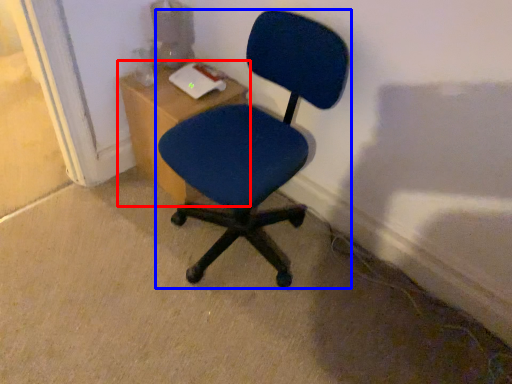
Question: Which of the following is the closest to the observer, table (highlighted by a red box) or chair (highlighted by a blue box)?

Choices:
 (A) table
 (B) chair

Answer: (B)